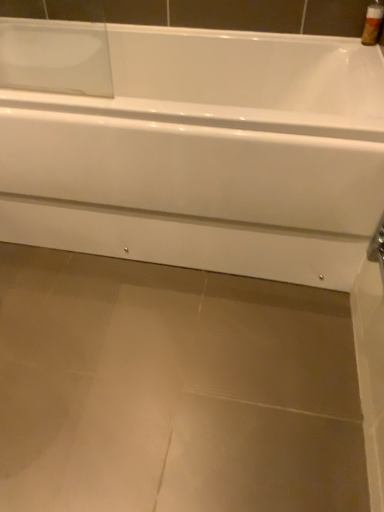
Describe the element at coordinates (206, 156) in the screenshot. I see `white glossy bathtub at center` at that location.

The width and height of the screenshot is (384, 512). Find the location of `white glossy bathtub at center`. white glossy bathtub at center is located at coordinates (206, 156).

In order to face white glossy bathtub at center, should I rotate leftwards or rightwards?

It's best to rotate left around 5.563 degrees.

I want to click on white glossy bathtub at center, so pyautogui.click(x=206, y=156).